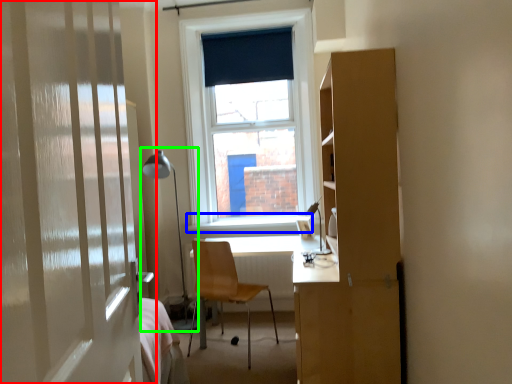
Question: Which object is positioned closest to door (highlighted by a red box)? Select from window sill (highlighted by a blue box) and table lamp (highlighted by a green box).

Choices:
 (A) window sill
 (B) table lamp

Answer: (B)